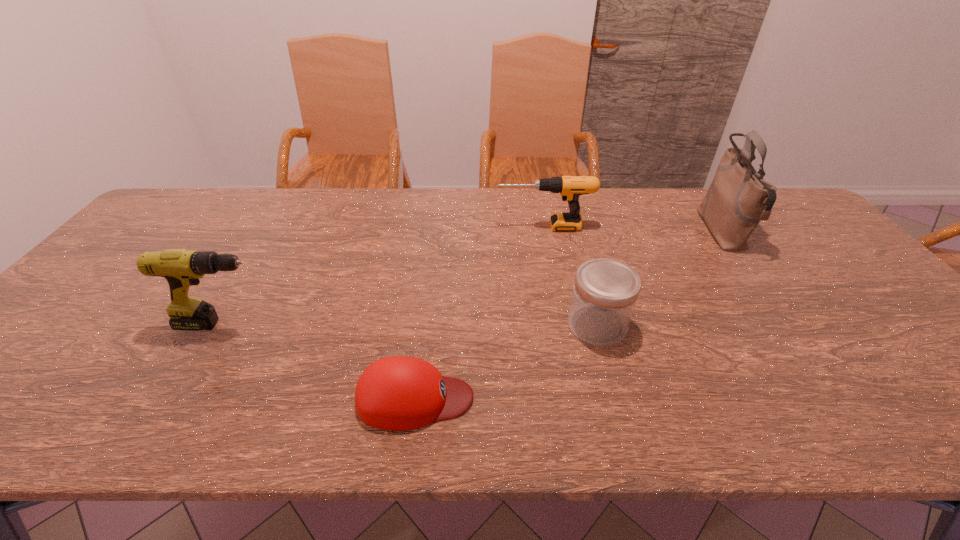
This screenshot has width=960, height=540. I want to click on object that is at the near edge, so click(x=398, y=393).

The height and width of the screenshot is (540, 960). What are the coordinates of `free location at the far edge` in the screenshot? It's located at (494, 215).

In the image, there is a desktop. Where is `vacant space at the near edge`? Image resolution: width=960 pixels, height=540 pixels. vacant space at the near edge is located at coordinates (358, 416).

In the image, there is a desktop. Find the location of `free region at the left edge`. free region at the left edge is located at coordinates (110, 271).

This screenshot has width=960, height=540. In order to click on vacant space that is in between the jar and the second object from left to right in this screenshot , I will do `click(506, 362)`.

Find the location of a particular element. Image resolution: width=960 pixels, height=540 pixels. empty space that is in between the second object from left to right and the jar is located at coordinates (506, 362).

Where is `free space between the rightmost object and the fourth tallest object`? This screenshot has height=540, width=960. free space between the rightmost object and the fourth tallest object is located at coordinates (660, 278).

The width and height of the screenshot is (960, 540). I want to click on free space that is in between the tallest object and the fourth tallest object, so click(660, 278).

The image size is (960, 540). What are the coordinates of `empty space that is in between the nearest object and the left drill` in the screenshot? It's located at (320, 361).

Where is `unoccupied area between the second tallest object and the fourth object from right to left`? The width and height of the screenshot is (960, 540). unoccupied area between the second tallest object and the fourth object from right to left is located at coordinates (320, 361).